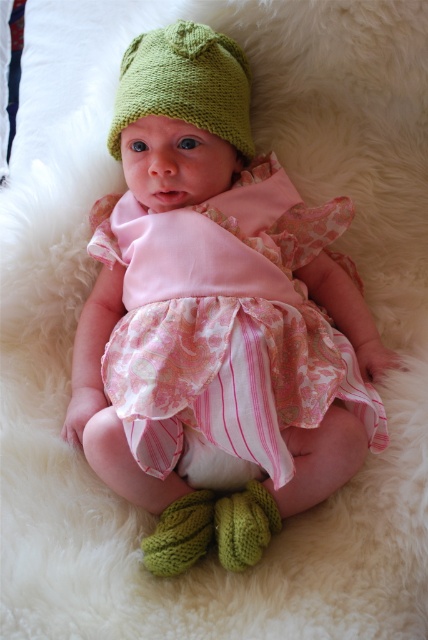
Is pink floral fabric dress at center behind green knitted hat at upper center?

No, it is in front of green knitted hat at upper center.

Which is in front, point (222, 346) or point (171, 113)?

Point (222, 346) is in front.

Find the location of a particular element. pink floral fabric dress at center is located at coordinates coord(225,330).

Find the location of a particular element. Image resolution: width=428 pixels, height=640 pixels. pink floral fabric dress at center is located at coordinates (225, 330).